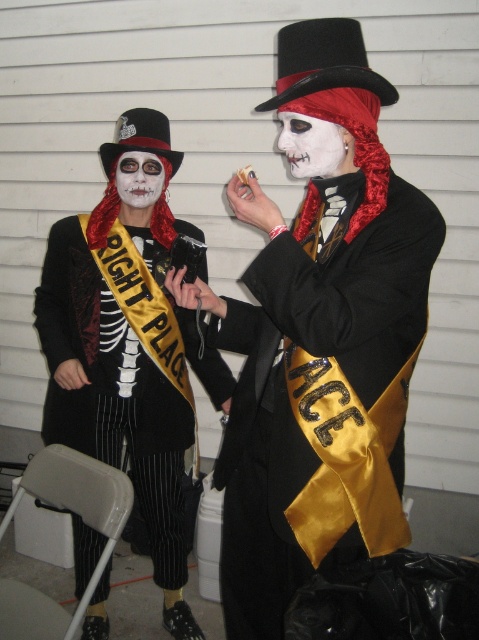
You are standing in front of two costumed individuals. You notice two points marked on the image, one at point (155, 572) and another at point (148, 156). Which point is closer to you?

Point (155, 572) is further to the viewer than point (148, 156), so the point at (148, 156) is closer to you.

You are a photographer at a costume party and need to take a group photo of the two individuals with white matte face at center and white matte face paint at center. Which individual has a smaller face area in the photo?

The white matte face at center has a smaller face area than the white matte face paint at center because it is not as tall.

You are a photographer standing at the origin point of the image coordinate system. You need to capture a closeup shot of the matte black coat at center. What are the coordinates where you should aim your camera?

The coordinates to aim your camera are at point (113, 392) to capture the matte black coat at center.